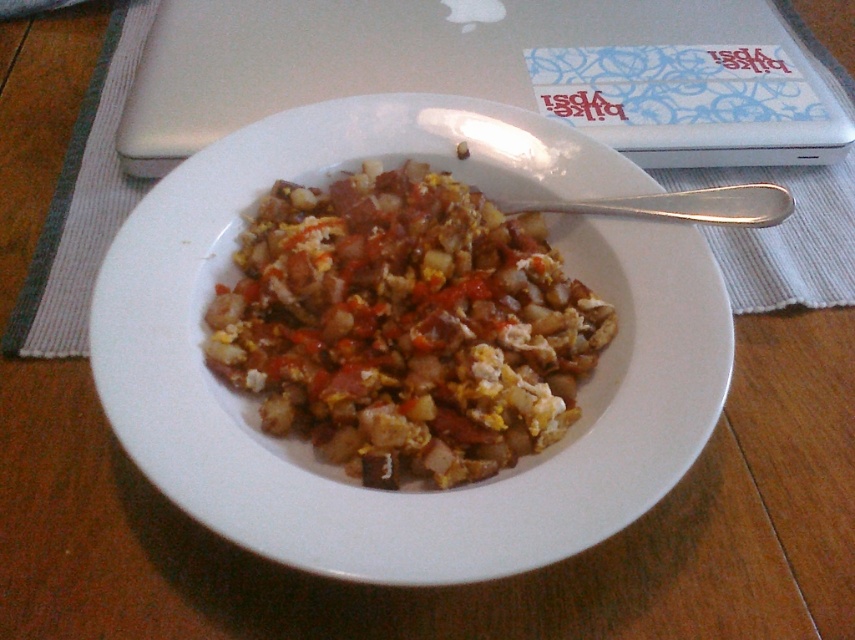
Question: Is yellow scrambled eggs at center below silver metallic laptop at upper center?

Choices:
 (A) yes
 (B) no

Answer: (A)

Question: Does white glossy plate at center have a greater width compared to yellow scrambled eggs at center?

Choices:
 (A) yes
 (B) no

Answer: (A)

Question: Which of the following is the farthest from the observer?

Choices:
 (A) silver metallic laptop at upper center
 (B) white fabric placemat at center
 (C) yellow scrambled eggs at center

Answer: (A)

Question: Which object is positioned farthest from the white fabric placemat at center?

Choices:
 (A) silver metallic laptop at upper center
 (B) yellow scrambled eggs at center

Answer: (A)

Question: Which point is farther to the camera?

Choices:
 (A) (679, 230)
 (B) (800, 140)

Answer: (B)

Question: Can you confirm if yellow scrambled eggs at center is smaller than white fabric placemat at center?

Choices:
 (A) yes
 (B) no

Answer: (A)